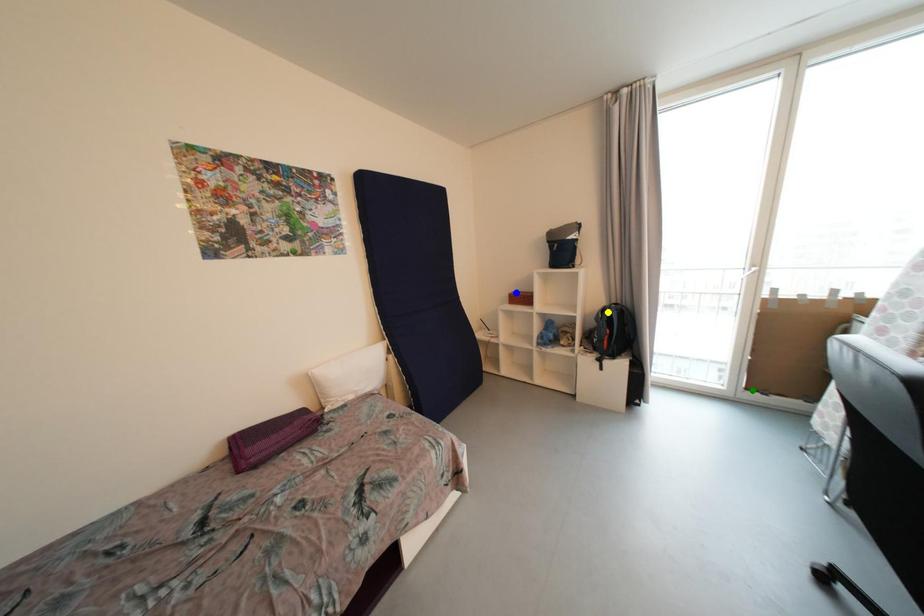
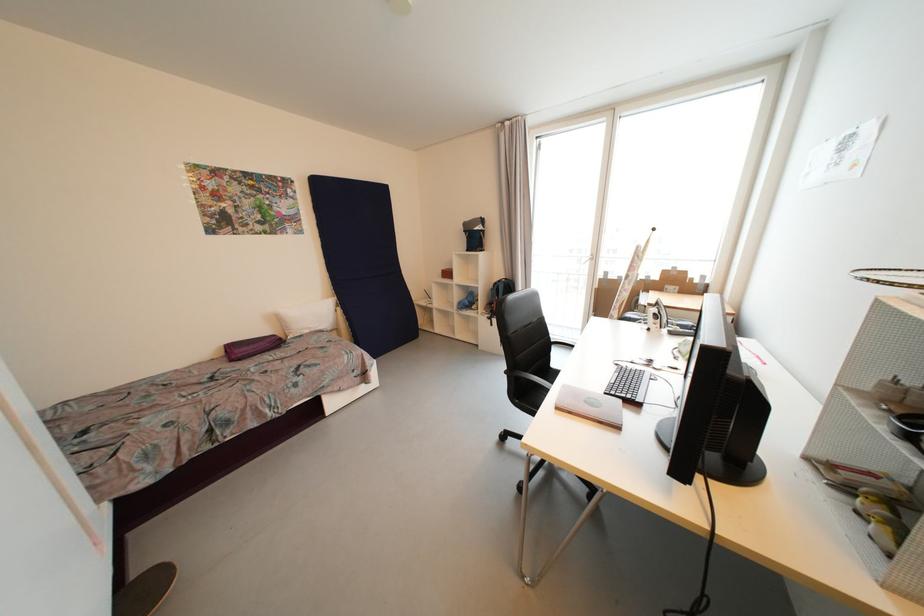
I am providing you with two images of the same scene from different viewpoints. Three points are marked in image1. Which point corresponds to a part or object that is occluded in image2?In image1, three points are marked. Which of them correspond to a part or object that is occluded in image2?Among the three points shown in image1, which one corresponds to a part or object that is no longer visible due to occlusion in image2?

green point